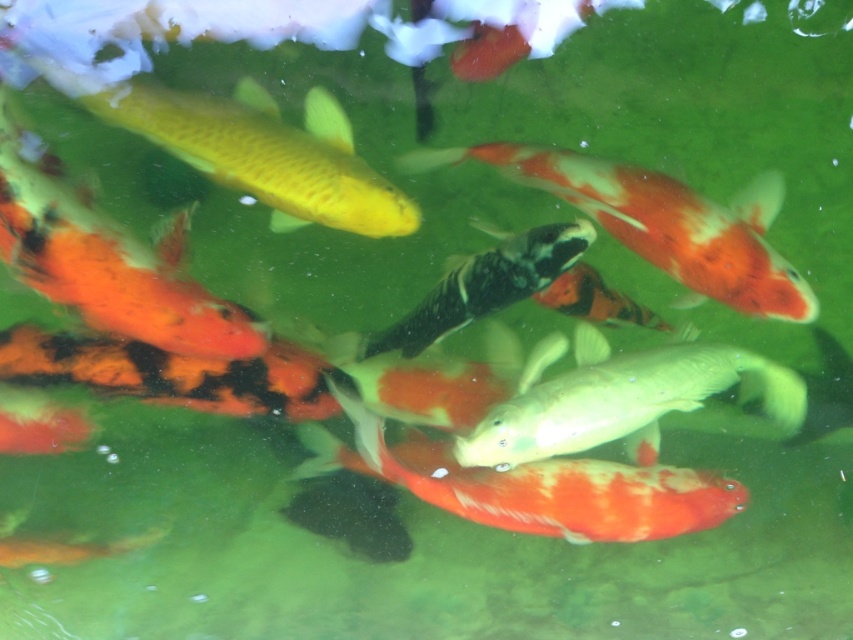
Can you confirm if orange and white speckled goldfish at center is smaller than matte green fish at center?

No, orange and white speckled goldfish at center is not smaller than matte green fish at center.

Does orange and white speckled goldfish at center have a larger size compared to matte green fish at center?

Correct, orange and white speckled goldfish at center is larger in size than matte green fish at center.

Is point (515, 180) behind point (561, 417)?

Yes.

The image size is (853, 640). I want to click on orange and white speckled goldfish at center, so click(x=662, y=221).

Can you confirm if matte green fish at center is positioned below shiny black and white fish at center?

Yes.

Can you confirm if matte green fish at center is taller than shiny black and white fish at center?

Correct, matte green fish at center is much taller as shiny black and white fish at center.

Describe the element at coordinates (619, 396) in the screenshot. I see `matte green fish at center` at that location.

This screenshot has height=640, width=853. I want to click on matte green fish at center, so click(x=619, y=396).

Does orange and white speckled goldfish at center appear over shiny black and white fish at center?

Indeed, orange and white speckled goldfish at center is positioned over shiny black and white fish at center.

Is orange and white speckled goldfish at center to the left of shiny black and white fish at center from the viewer's perspective?

In fact, orange and white speckled goldfish at center is to the right of shiny black and white fish at center.

Between point (761, 289) and point (552, 269), which one is positioned in front?

Point (761, 289) is in front.

The height and width of the screenshot is (640, 853). Find the location of `orange and white speckled goldfish at center`. orange and white speckled goldfish at center is located at coordinates (662, 221).